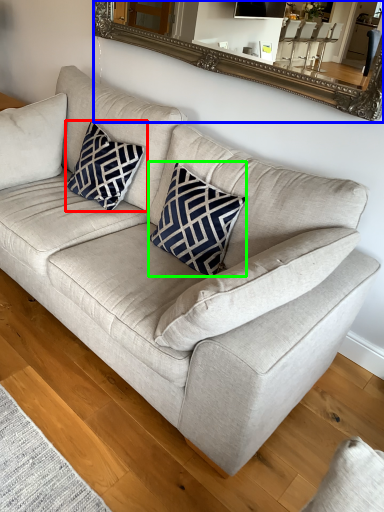
Question: Which is nearer to the pillow (highlighted by a red box)? mirror (highlighted by a blue box) or throw pillow (highlighted by a green box).

Choices:
 (A) mirror
 (B) throw pillow

Answer: (B)